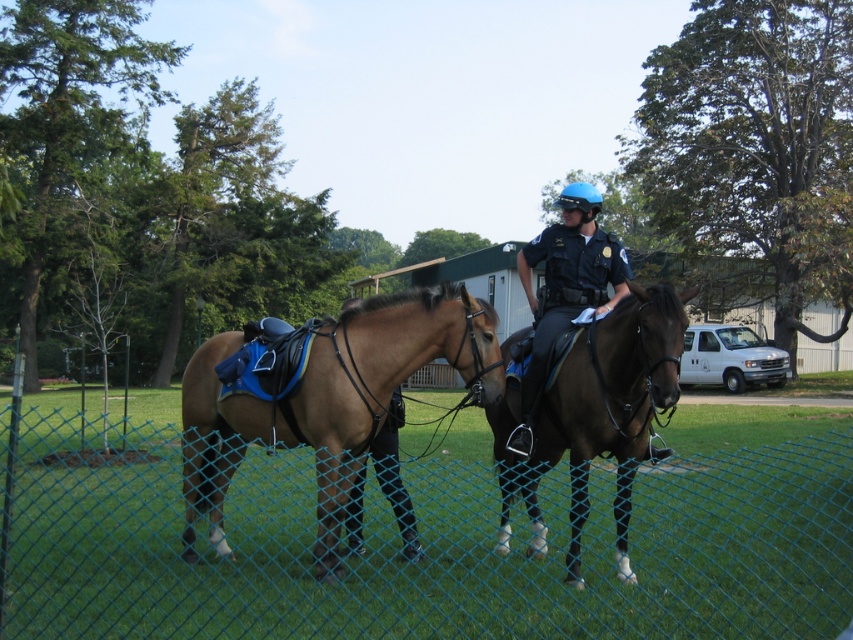
Question: Which of the following is the closest to the observer?

Choices:
 (A) (631, 305)
 (B) (318, 464)
 (C) (518, 273)

Answer: (A)

Question: Which point is farther from the camera taking this photo?

Choices:
 (A) (425, 435)
 (B) (607, 262)
 (C) (404, 340)
 (D) (577, 428)

Answer: (A)

Question: Can you confirm if brown leather horse at center is smaller than dark blue uniform at center?

Choices:
 (A) no
 (B) yes

Answer: (B)

Question: Is brown leather saddle at center in front of dark blue uniform at center?

Choices:
 (A) yes
 (B) no

Answer: (B)

Question: Does green chain-link fence at lower center appear over brown leather horse at center?

Choices:
 (A) no
 (B) yes

Answer: (A)

Question: Which point is farther to the camera?

Choices:
 (A) brown leather saddle at center
 (B) green chain-link fence at lower center
 (C) dark blue uniform at center

Answer: (A)